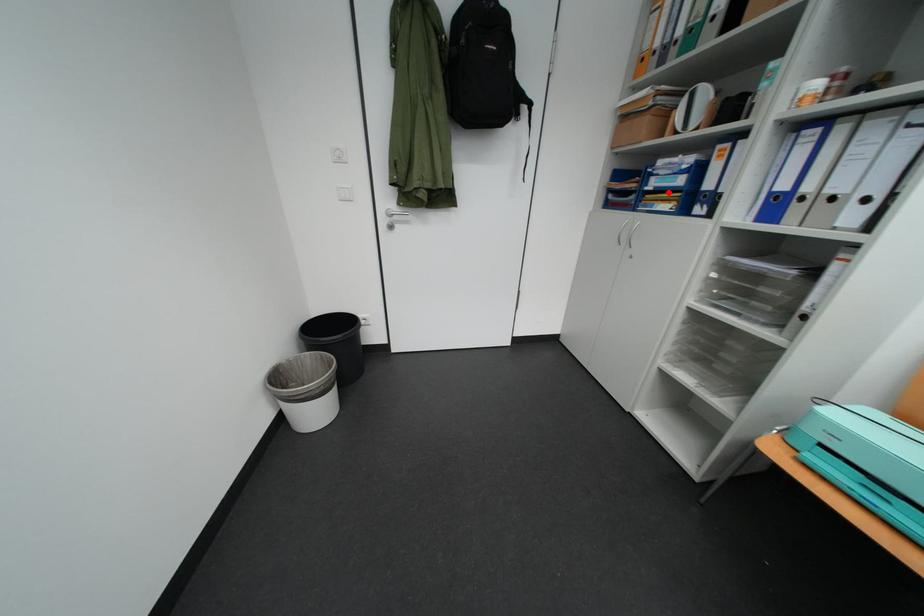
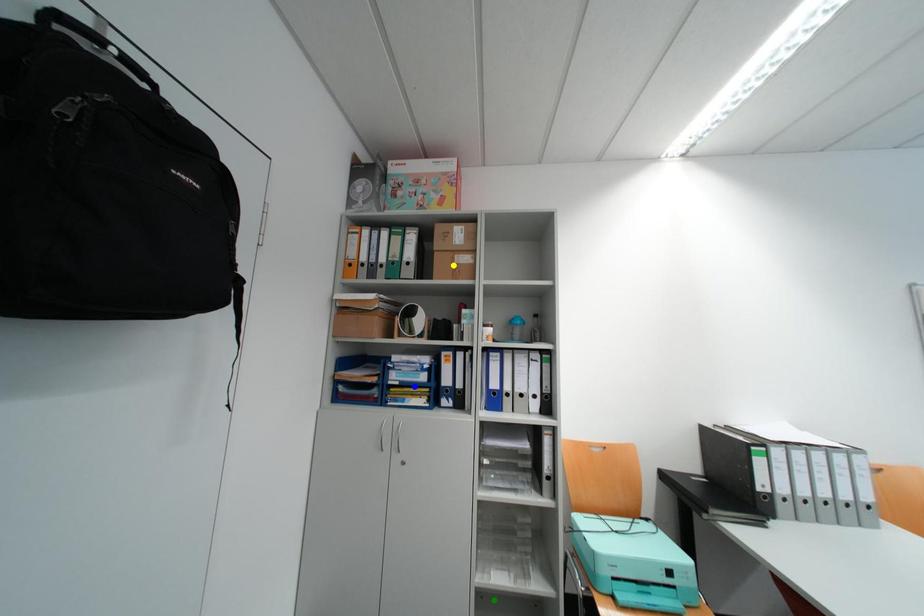
Question: I am providing you with two images of the same scene from different viewpoints. A red point is marked on the first image. You are given multiple points on the second image. In image 2, which mark is for the same physical point as the one in image 1?

Choices:
 (A) blue point
 (B) yellow point
 (C) green point

Answer: (A)